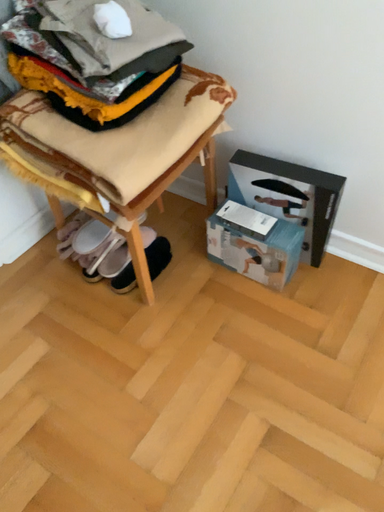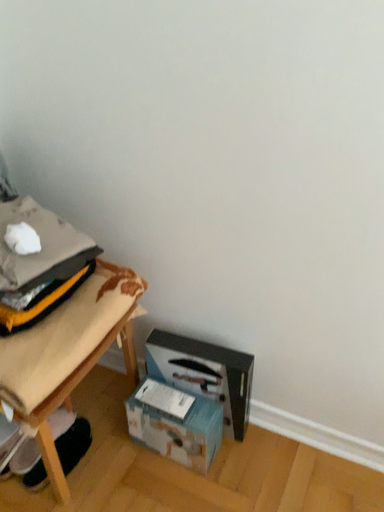
Question: How did the camera likely rotate when shooting the video?

Choices:
 (A) rotated right
 (B) rotated left

Answer: (A)